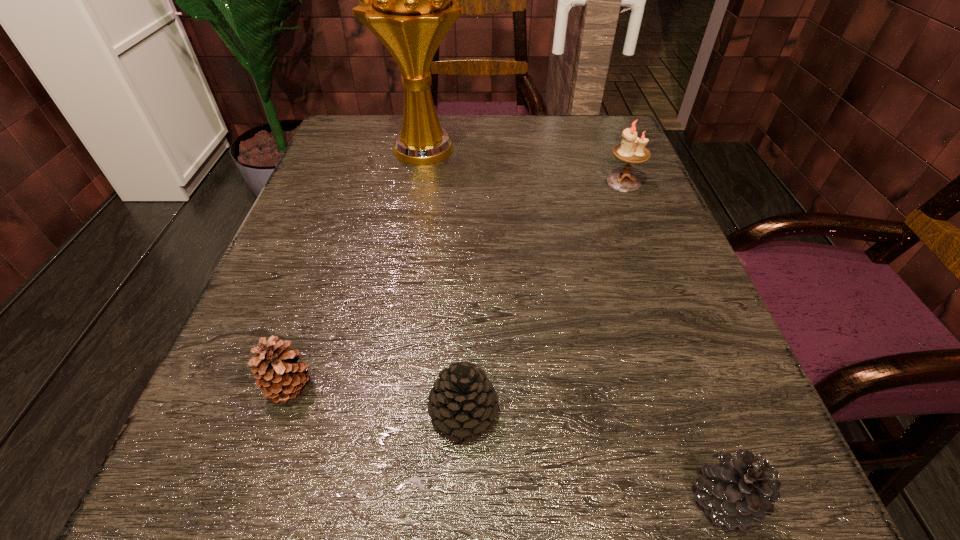
Identify the location of vacant region that satisfies the following two spatial constraints: 1. at the front of the fourth shortest object where the globe is prominent; 2. on the left side of the trophy_cup. The image size is (960, 540). (420, 182).